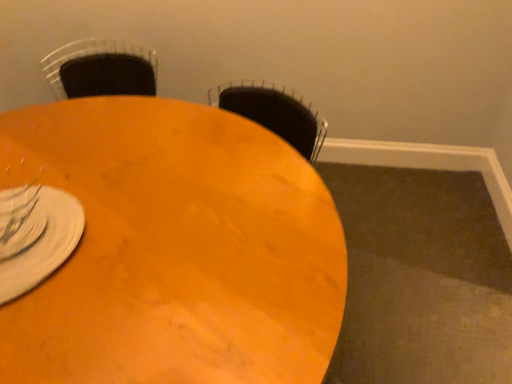
Question: Is the depth of clear glass fork at lower left less than that of wooden table at center?

Choices:
 (A) no
 (B) yes

Answer: (A)

Question: Is clear glass fork at lower left oriented towards wooden table at center?

Choices:
 (A) no
 (B) yes

Answer: (A)

Question: Can you confirm if clear glass fork at lower left is taller than wooden table at center?

Choices:
 (A) no
 (B) yes

Answer: (A)

Question: Is wooden table at center a part of clear glass fork at lower left?

Choices:
 (A) no
 (B) yes

Answer: (A)

Question: Is clear glass fork at lower left oriented away from wooden table at center?

Choices:
 (A) yes
 (B) no

Answer: (B)

Question: Can you confirm if clear glass fork at lower left is positioned to the right of wooden table at center?

Choices:
 (A) no
 (B) yes

Answer: (A)

Question: Is wooden table at center positioned behind clear glass fork at lower left?

Choices:
 (A) yes
 (B) no

Answer: (B)

Question: Are wooden table at center and clear glass fork at lower left far apart?

Choices:
 (A) no
 (B) yes

Answer: (A)

Question: Does wooden table at center appear on the right side of clear glass fork at lower left?

Choices:
 (A) no
 (B) yes

Answer: (B)

Question: Considering the relative sizes of wooden table at center and clear glass fork at lower left in the image provided, is wooden table at center thinner than clear glass fork at lower left?

Choices:
 (A) yes
 (B) no

Answer: (B)

Question: Is wooden table at center outside of clear glass fork at lower left?

Choices:
 (A) no
 (B) yes

Answer: (B)

Question: Does wooden table at center have a lesser height compared to clear glass fork at lower left?

Choices:
 (A) yes
 (B) no

Answer: (B)

Question: Choose the correct answer: Is clear glass fork at lower left inside wooden table at center or outside it?

Choices:
 (A) inside
 (B) outside

Answer: (B)